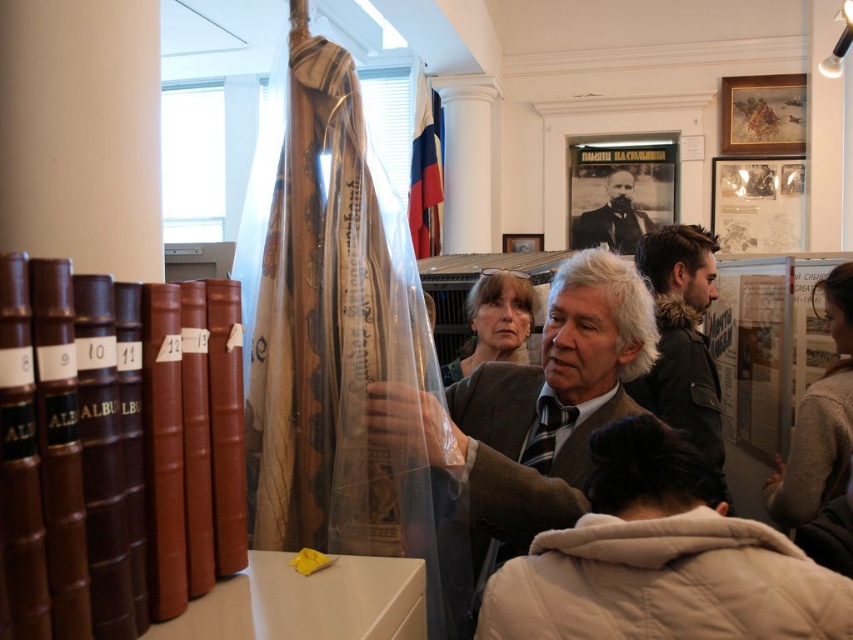
Can you confirm if brown leather book at left is wider than beige wool coat at lower right?

In fact, brown leather book at left might be narrower than beige wool coat at lower right.

Where is `brown leather book at left`? brown leather book at left is located at coordinates (64, 460).

Who is lower down, beige wool coat at lower right or smooth black suit at center?

beige wool coat at lower right is lower down.

Can you confirm if beige wool coat at lower right is thinner than smooth black suit at center?

Yes, beige wool coat at lower right is thinner than smooth black suit at center.

Who is more distant from viewer, (842, 618) or (630, 220)?

The point (630, 220) is more distant.

Locate an element on the screen. The width and height of the screenshot is (853, 640). beige wool coat at lower right is located at coordinates (660, 561).

Which is more to the right, beige wool coat at lower right or matte gray jacket at center?

beige wool coat at lower right

Which is in front, point (733, 525) or point (515, 326)?

Point (733, 525)

Identify the location of beige wool coat at lower right. (660, 561).